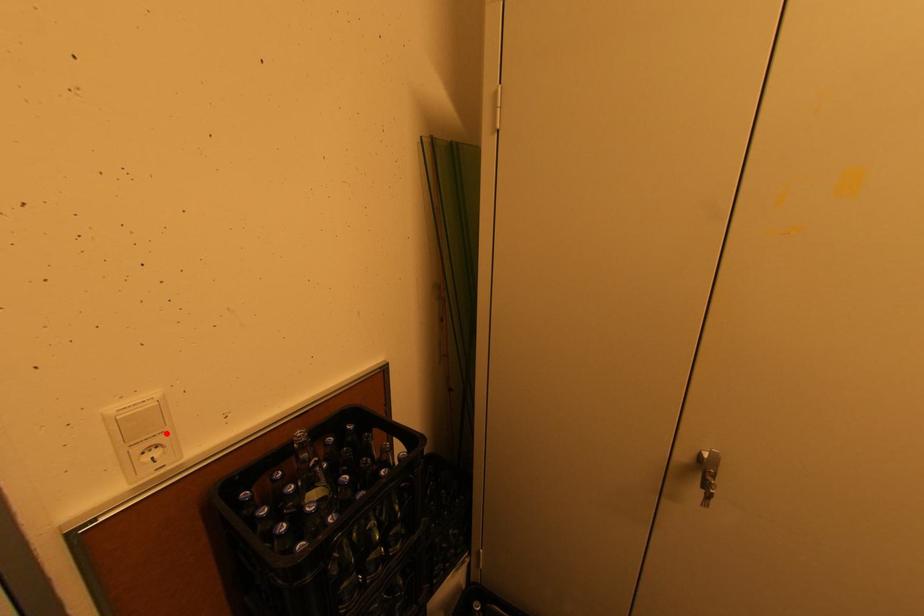
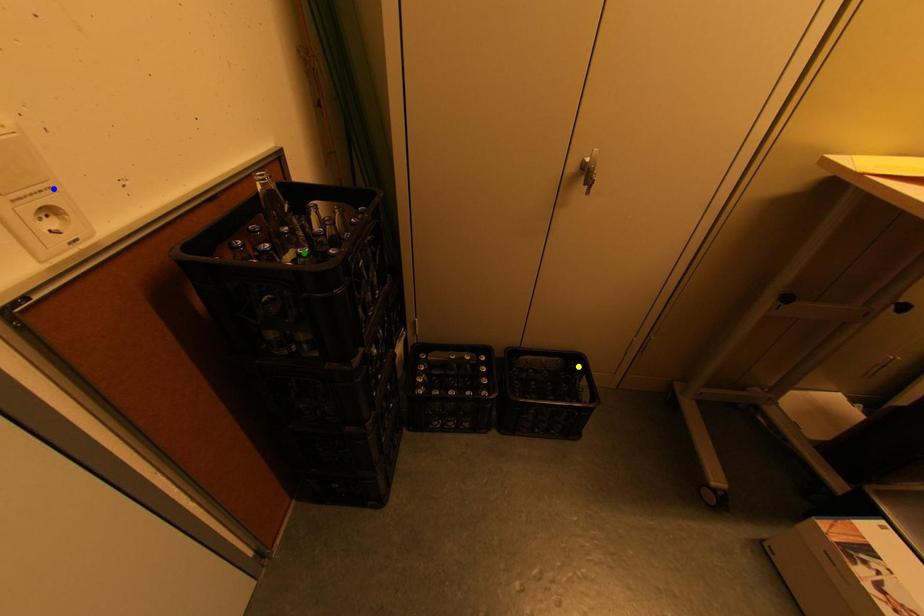
Question: I am providing you with two images of the same scene from different viewpoints. A red point is marked on the first image. You are given multiple points on the second image. Which spot in image 2 lines up with the point in image 1?

Choices:
 (A) yellow point
 (B) blue point
 (C) green point

Answer: (B)